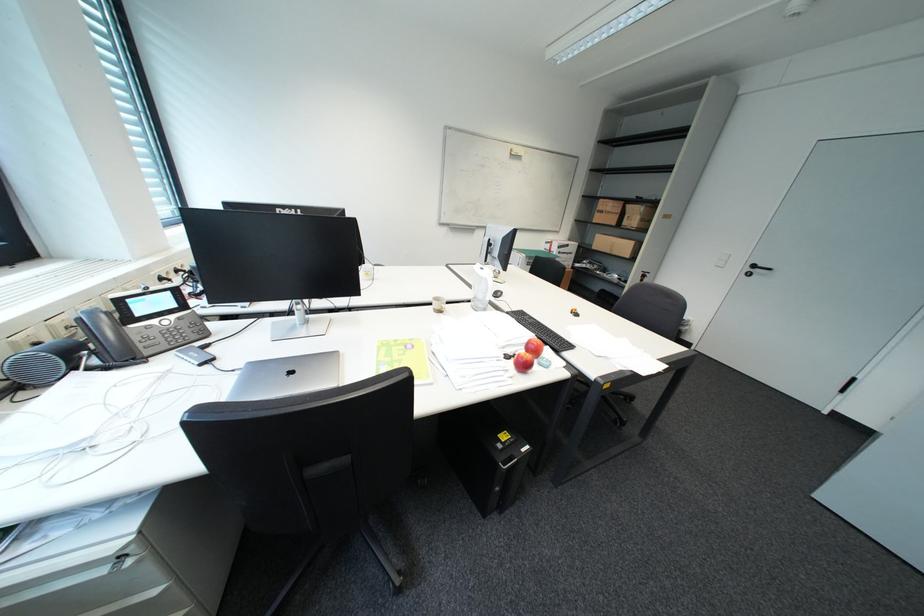
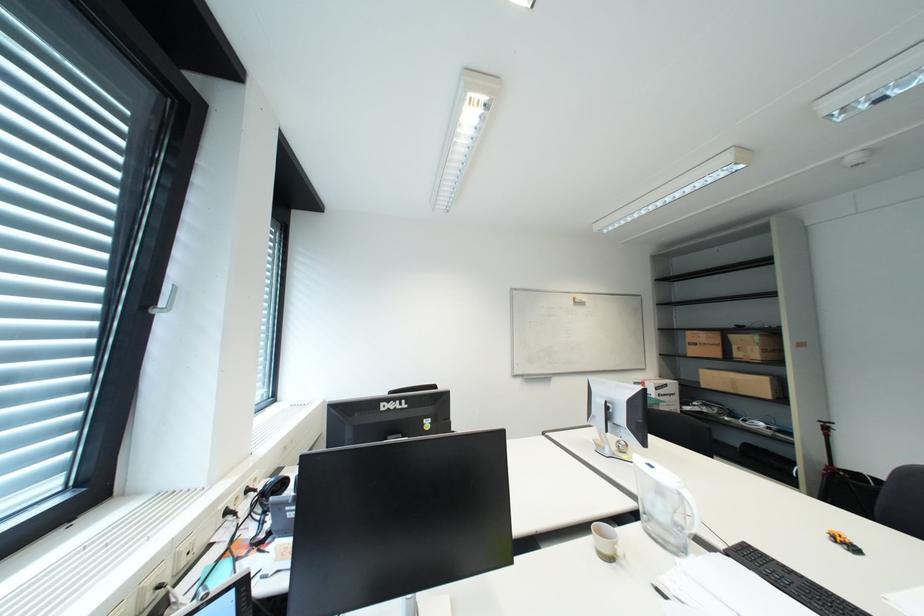
Question: The images are taken continuously from a first-person perspective. In which direction is your viewpoint rotating?

Choices:
 (A) Left
 (B) Right
 (C) Up
 (D) Down

Answer: (C)